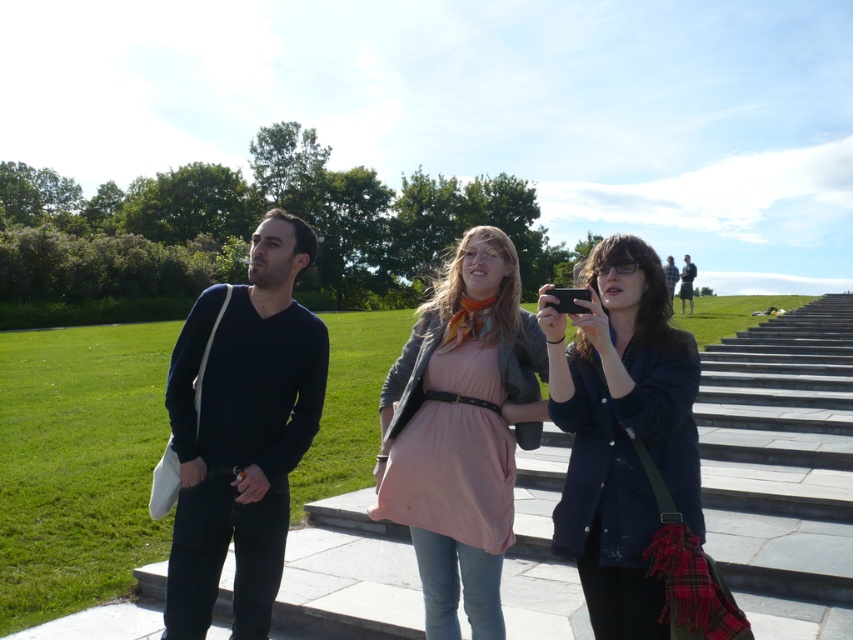
Can you confirm if dark blue sweater at center is positioned below pink fabric dress at center?

No, dark blue sweater at center is not below pink fabric dress at center.

What do you see at coordinates (242, 432) in the screenshot? I see `dark blue sweater at center` at bounding box center [242, 432].

Find the location of `dark blue sweater at center`. dark blue sweater at center is located at coordinates (242, 432).

Is point (399, 458) positioned in front of point (685, 282)?

Yes.

Does pink fabric dress at center come behind dark blue shirt at upper right?

No, it is in front of dark blue shirt at upper right.

Is point (380, 467) positioned after point (682, 284)?

No, (380, 467) is closer to viewer.

In order to click on pink fabric dress at center in this screenshot , I will do `click(462, 432)`.

From the picture: Who is higher up, pink fabric dress at center or matte black jacket at center?

matte black jacket at center is higher up.

Who is shorter, pink fabric dress at center or matte black jacket at center?

pink fabric dress at center is shorter.

Is point (473, 541) positioned after point (631, 324)?

Yes, point (473, 541) is behind point (631, 324).

Find the location of a particular element. The width and height of the screenshot is (853, 640). pink fabric dress at center is located at coordinates (462, 432).